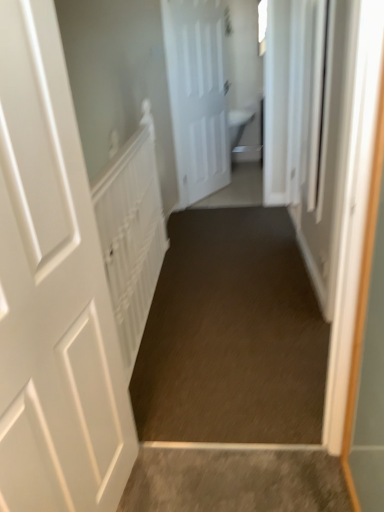
This screenshot has height=512, width=384. Identify the location of white matte door at left, the 2th door viewed from the right. (53, 291).

Where is `white matte door at center, acting as the 1th door starting from the back`? white matte door at center, acting as the 1th door starting from the back is located at coordinates (197, 96).

What is the approximate width of white textured radiator at left?

It is 9.82 centimeters.

Locate an element on the screen. The width and height of the screenshot is (384, 512). white matte door at left, the 2th door viewed from the right is located at coordinates (53, 291).

Is there a large distance between white textured radiator at left and brown carpet at center?

No, white textured radiator at left is not far from brown carpet at center.

Which object is positioned more to the right, white textured radiator at left or brown carpet at center?

brown carpet at center.

Looking at their sizes, would you say white textured radiator at left is wider or thinner than brown carpet at center?

In the image, white textured radiator at left appears to be more narrow than brown carpet at center.

How many degrees apart are the facing directions of white matte door at left, placed as the first door when sorted from left to right, and white matte door at center, which appears as the 2th door when viewed from the left?

white matte door at left, placed as the first door when sorted from left to right, and white matte door at center, which appears as the 2th door when viewed from the left, are facing 23.2 degrees away from each other.

Considering the positions of objects white matte door at left, placed as the first door when sorted from left to right, and white matte door at center, which is the first door from right to left, in the image provided, who is more to the left, white matte door at left, placed as the first door when sorted from left to right, or white matte door at center, which is the first door from right to left,?

From the viewer's perspective, white matte door at left, placed as the first door when sorted from left to right, appears more on the left side.

Could you tell me if white matte door at left, which ranks as the second door in top-to-bottom order, is facing white matte door at center, which ranks as the 2th door in front-to-back order?

No, white matte door at left, which ranks as the second door in top-to-bottom order, is not oriented towards white matte door at center, which ranks as the 2th door in front-to-back order.

Which of these two, brown carpet at center or white textured radiator at left, is bigger?

With larger size is brown carpet at center.

Is brown carpet at center far away from white textured radiator at left?

No.

Which object is closer to the camera taking this photo, brown carpet at center or white textured radiator at left?

Positioned in front is brown carpet at center.

Could you tell me if brown carpet at center is turned towards white textured radiator at left?

No, brown carpet at center is not turned towards white textured radiator at left.

Is the surface of white matte door at center, positioned as the 2th door in bottom-to-top order, in direct contact with white textured radiator at left?

white matte door at center, positioned as the 2th door in bottom-to-top order, is not next to white textured radiator at left, and they're not touching.

From the image's perspective, is white matte door at center, which is the first door from right to left, beneath white textured radiator at left?

Actually, white matte door at center, which is the first door from right to left, appears above white textured radiator at left in the image.

Where is `radiator lying in front of the white matte door at center, which appears as the 2th door when viewed from the left`? radiator lying in front of the white matte door at center, which appears as the 2th door when viewed from the left is located at coordinates (131, 234).

Measure the distance between brown carpet at center and white matte door at left, acting as the 1th door starting from the bottom.

brown carpet at center and white matte door at left, acting as the 1th door starting from the bottom, are 35.69 inches apart.

Based on their sizes in the image, would you say brown carpet at center is bigger or smaller than white matte door at left, which ranks as the second door in top-to-bottom order?

Clearly, brown carpet at center is larger in size than white matte door at left, which ranks as the second door in top-to-bottom order.

Consider the image. Which of these two, brown carpet at center or white matte door at left, the 2th door viewed from the right, stands shorter?

brown carpet at center.

Considering the relative positions of brown carpet at center and white matte door at left, which appears as the first door when viewed from the front, in the image provided, is brown carpet at center behind white matte door at left, which appears as the first door when viewed from the front,?

Yes.

Can you confirm if white matte door at center, positioned as the 2th door in bottom-to-top order, is thinner than white matte door at left, which appears as the first door when viewed from the front?

Indeed, white matte door at center, positioned as the 2th door in bottom-to-top order, has a lesser width compared to white matte door at left, which appears as the first door when viewed from the front.

Is white matte door at center, which appears as the 2th door when viewed from the left, situated inside white matte door at left, placed as the first door when sorted from left to right, or outside?

white matte door at center, which appears as the 2th door when viewed from the left, is outside white matte door at left, placed as the first door when sorted from left to right.

From the image's perspective, which is below, white matte door at center, which is the first door from right to left, or white matte door at left, placed as the first door when sorted from left to right?

white matte door at left, placed as the first door when sorted from left to right.

In the scene shown: Is white matte door at center, placed as the first door when sorted from top to bottom, with white matte door at left, the 2th door viewed from the right?

No, white matte door at center, placed as the first door when sorted from top to bottom, is not next to white matte door at left, the 2th door viewed from the right.

Does white textured radiator at left lie in front of white matte door at left, which appears as the first door when viewed from the front?

That is False.

Who is shorter, white textured radiator at left or white matte door at left, which ranks as the second door in top-to-bottom order?

Standing shorter between the two is white textured radiator at left.

Is white textured radiator at left outside of white matte door at left, acting as the 1th door starting from the bottom?

Indeed, white textured radiator at left is completely outside white matte door at left, acting as the 1th door starting from the bottom.

How distant is white textured radiator at left from white matte door at left, acting as the 1th door starting from the bottom?

27.20 inches.

Locate an element on the screen. radiator on the left of brown carpet at center is located at coordinates (131, 234).

You are a GUI agent. You are given a task and a screenshot of the screen. Output one action in this format:
    pyautogui.click(x=<x>, y=<y>)
    Task: Click on the door that is below the white matte door at center, which appears as the 2th door when viewed from the left (from the image's perspective)
    Image resolution: width=384 pixels, height=512 pixels.
    Given the screenshot: What is the action you would take?
    pyautogui.click(x=53, y=291)

Based on their spatial positions, is white textured radiator at left or white matte door at left, positioned as the second door in back-to-front order, closer to white matte door at center, which ranks as the 2th door in front-to-back order?

The object closer to white matte door at center, which ranks as the 2th door in front-to-back order, is white textured radiator at left.

Considering their positions, is white textured radiator at left positioned closer to white matte door at left, positioned as the second door in back-to-front order, than brown carpet at center?

white textured radiator at left is positioned closer to the anchor white matte door at left, positioned as the second door in back-to-front order.

Which object lies further to the anchor point white matte door at center, which ranks as the 2th door in front-to-back order, white matte door at left, acting as the 1th door starting from the bottom, or white textured radiator at left?

white matte door at left, acting as the 1th door starting from the bottom, is further to white matte door at center, which ranks as the 2th door in front-to-back order.

From the picture: Looking at the image, which one is located closer to white textured radiator at left, brown carpet at center or white matte door at center, positioned as the 2th door in bottom-to-top order?

Among the two, brown carpet at center is located nearer to white textured radiator at left.

Which object lies further to the anchor point white matte door at center, which is the first door from right to left, white textured radiator at left or brown carpet at center?

The object further to white matte door at center, which is the first door from right to left, is brown carpet at center.

Consider the image. When comparing their distances from brown carpet at center, does white matte door at left, the 2th door viewed from the right, or white textured radiator at left seem closer?

Based on the image, white textured radiator at left appears to be nearer to brown carpet at center.

When comparing their distances from white textured radiator at left, does white matte door at center, placed as the first door when sorted from top to bottom, or white matte door at left, positioned as the second door in back-to-front order, seem closer?

The object closer to white textured radiator at left is white matte door at left, positioned as the second door in back-to-front order.

Based on the photo, based on their spatial positions, is white matte door at left, placed as the first door when sorted from left to right, or white matte door at center, positioned as the 2th door in bottom-to-top order, further from white textured radiator at left?

The object further to white textured radiator at left is white matte door at center, positioned as the 2th door in bottom-to-top order.

Identify the location of path between white matte door at left, positioned as the second door in back-to-front order, and white textured radiator at left from front to back. (232, 335).

Image resolution: width=384 pixels, height=512 pixels. Find the location of `path between white matte door at left, the 2th door viewed from the right, and white matte door at center, which ranks as the 2th door in front-to-back order, in the front-back direction`. path between white matte door at left, the 2th door viewed from the right, and white matte door at center, which ranks as the 2th door in front-to-back order, in the front-back direction is located at coordinates (232, 335).

Image resolution: width=384 pixels, height=512 pixels. I want to click on radiator between brown carpet at center and white matte door at center, positioned as the 2th door in bottom-to-top order, in the front-back direction, so click(x=131, y=234).

Locate an element on the screen. This screenshot has width=384, height=512. radiator positioned between white matte door at left, acting as the 1th door starting from the bottom, and white matte door at center, which appears as the 2th door when viewed from the left, from near to far is located at coordinates (131, 234).